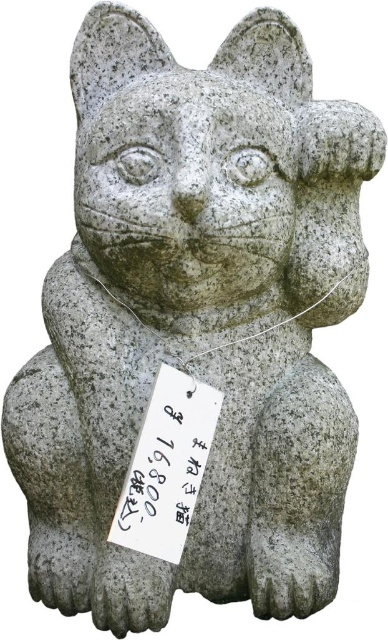
You are a photographer trying to capture the statue of the cat. You notice two points on the statue marked at coordinates point (154, 481) and point (363, 257). Which point will appear larger in your photo?

Point (154, 481) is closer to the camera than point (363, 257), so it will appear larger in the photo.

Based on the photo, you are a visitor at an art gallery and see the black paper at center and the gray stone cat at center. Which object is positioned lower in the image?

The black paper at center is located below the gray stone cat at center, so it is positioned lower in the image.